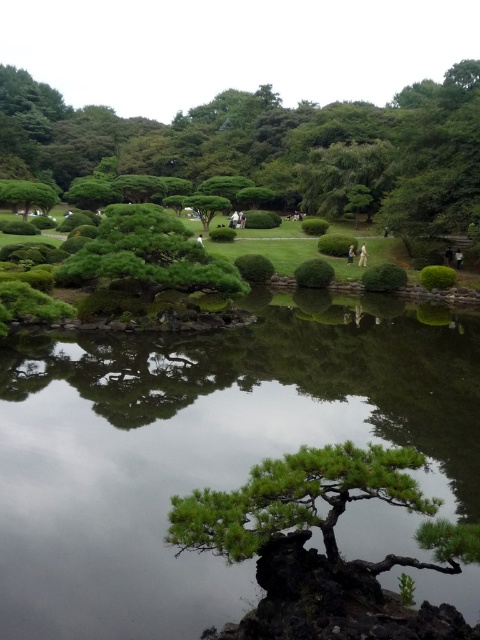
Question: Among these points, which one is nearest to the camera?

Choices:
 (A) (x=108, y=273)
 (B) (x=59, y=493)
 (C) (x=377, y=470)
 (D) (x=330, y=189)

Answer: (C)

Question: Which of the following is the closest to the observer?

Choices:
 (A) (262, 547)
 (B) (168, 636)

Answer: (A)

Question: Is green reflective water at center below green textured bush at center?

Choices:
 (A) yes
 (B) no

Answer: (A)

Question: Which point is farther to the camera?

Choices:
 (A) (177, 541)
 (B) (50, 420)

Answer: (B)

Question: Does green reflective water at center have a larger size compared to green leafy bush at upper center?

Choices:
 (A) yes
 (B) no

Answer: (B)

Question: Can you confirm if green reflective water at center is thinner than green leafy bush at upper center?

Choices:
 (A) no
 (B) yes

Answer: (B)